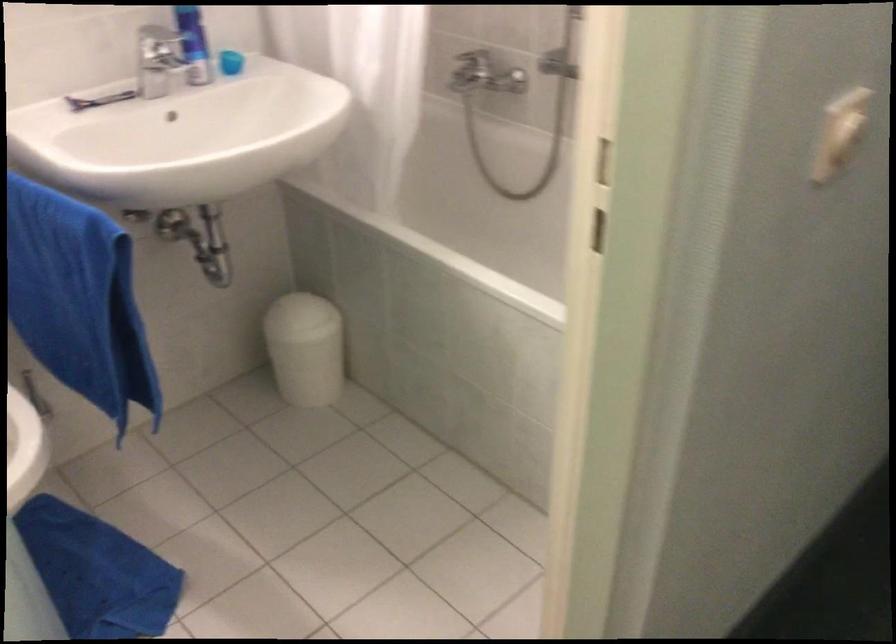
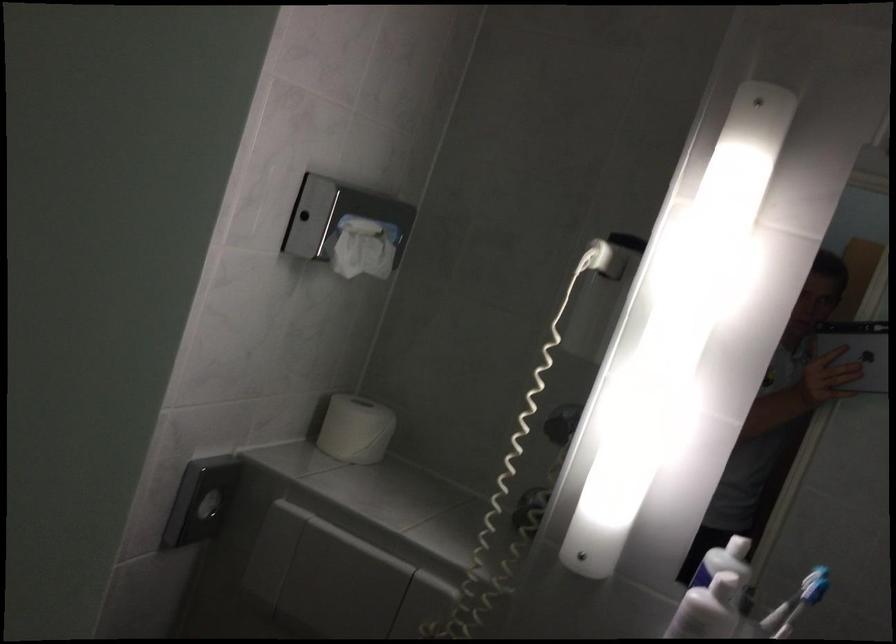
Question: The camera is either moving clockwise (left) or counter-clockwise (right) around the object. The first image is from the beginning of the video and the second image is from the end. Is the camera moving left or right when shooting the video?

Choices:
 (A) Left
 (B) Right

Answer: (B)